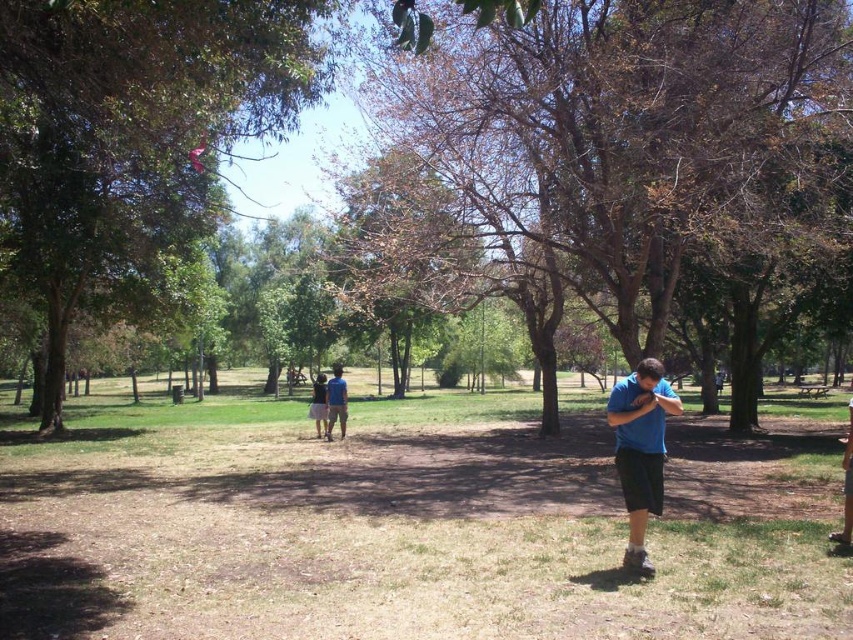
Question: Which object is the closest to the dark blue t-shirt at center?

Choices:
 (A) brown grass at center
 (B) brown leather bag at lower right
 (C) brown leafy tree at center

Answer: (C)

Question: Which of the following is the farthest from the observer?

Choices:
 (A) (341, 387)
 (B) (461, 442)
 (C) (637, 468)
 (D) (309, 406)

Answer: (D)

Question: Does blue cotton shirt at lower right appear on the left side of brown leather bag at lower right?

Choices:
 (A) yes
 (B) no

Answer: (A)

Question: Which of the following is the closest to the observer?

Choices:
 (A) (677, 412)
 (B) (846, 440)
 (C) (341, 390)
 (D) (312, 403)

Answer: (A)

Question: Is green leafy tree at upper left to the right of blue cotton shirt at lower right from the viewer's perspective?

Choices:
 (A) yes
 (B) no

Answer: (B)

Question: Where is brown grass at center located in relation to dark blue t-shirt at center in the image?

Choices:
 (A) right
 (B) left

Answer: (A)